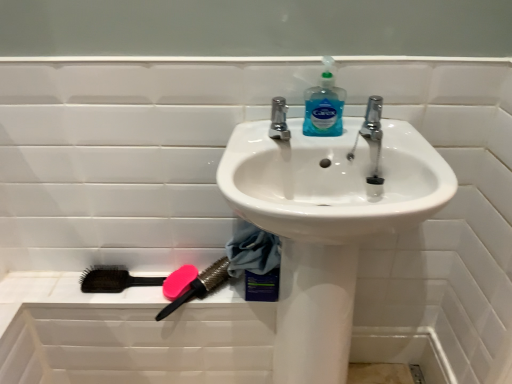
Measure the distance between black plastic brush at lower left, which is counted as the first brush, starting from the left, and camera.

black plastic brush at lower left, which is counted as the first brush, starting from the left, and camera are 1.14 meters apart from each other.

In order to click on white glossy sink at center in this screenshot , I will do `click(328, 221)`.

You are a GUI agent. You are given a task and a screenshot of the screen. Output one action in this format:
    pyautogui.click(x=<x>, y=<y>)
    Task: Click on the pink rubber brush at lower left, which is the second brush in left-to-right order
    This screenshot has width=512, height=384.
    Given the screenshot: What is the action you would take?
    pyautogui.click(x=200, y=286)

Looking at this image, could you tell me if white glossy sink at center is turned towards pink rubber brush at lower left, which appears as the 1th brush when viewed from the right?

No, white glossy sink at center is not aimed at pink rubber brush at lower left, which appears as the 1th brush when viewed from the right.

From the image's perspective, is white glossy sink at center on top of pink rubber brush at lower left, which is the second brush in left-to-right order?

No.

Based on the photo, what's the angular difference between white glossy sink at center and pink rubber brush at lower left, which appears as the 1th brush when viewed from the right,'s facing directions?

The facing directions of white glossy sink at center and pink rubber brush at lower left, which appears as the 1th brush when viewed from the right, are 1.94 degrees apart.

Which object is closer to the camera taking this photo, white glossy sink at center or pink rubber brush at lower left, which appears as the 1th brush when viewed from the right?

Positioned in front is white glossy sink at center.

From a real-world perspective, is translucent plastic soap dispenser at upper center positioned over chrome metallic faucet at upper center based on gravity?

Yes.

Consider the image. Would you consider translucent plastic soap dispenser at upper center to be distant from chrome metallic faucet at upper center?

Actually, translucent plastic soap dispenser at upper center and chrome metallic faucet at upper center are a little close together.

Locate an element on the screen. cleaning product above the chrome metallic faucet at upper center (from the image's perspective) is located at coordinates (324, 106).

Does translucent plastic soap dispenser at upper center have a lesser height compared to chrome metallic faucet at upper center?

No, translucent plastic soap dispenser at upper center is not shorter than chrome metallic faucet at upper center.

Can you tell me how much pink rubber soap at lower left and pink rubber brush at lower left, which is the second brush in left-to-right order, differ in facing direction?

They differ by 0.000563 degrees in their facing directions.

From the image's perspective, is pink rubber soap at lower left above pink rubber brush at lower left, which appears as the 1th brush when viewed from the right?

Indeed, from the image's perspective, pink rubber soap at lower left is shown above pink rubber brush at lower left, which appears as the 1th brush when viewed from the right.

Is pink rubber soap at lower left aimed at pink rubber brush at lower left, which appears as the 1th brush when viewed from the right?

Yes, pink rubber soap at lower left is aimed at pink rubber brush at lower left, which appears as the 1th brush when viewed from the right.

Considering the relative sizes of pink rubber soap at lower left and pink rubber brush at lower left, which appears as the 1th brush when viewed from the right, in the image provided, is pink rubber soap at lower left wider than pink rubber brush at lower left, which appears as the 1th brush when viewed from the right,?

No, pink rubber soap at lower left is not wider than pink rubber brush at lower left, which appears as the 1th brush when viewed from the right.

The height and width of the screenshot is (384, 512). I want to click on brush that is the 1st one below the chrome metallic faucet at upper center (from a real-world perspective), so click(x=200, y=286).

Is pink rubber brush at lower left, which is the second brush in left-to-right order, bigger or smaller than chrome metallic faucet at upper center?

Clearly, pink rubber brush at lower left, which is the second brush in left-to-right order, is larger in size than chrome metallic faucet at upper center.

Can chrome metallic faucet at upper center be found inside pink rubber brush at lower left, which is the second brush in left-to-right order?

Actually, chrome metallic faucet at upper center is outside pink rubber brush at lower left, which is the second brush in left-to-right order.

Which of these two, pink rubber brush at lower left, which is the second brush in left-to-right order, or chrome metallic faucet at upper center, is thinner?

chrome metallic faucet at upper center is thinner.

From the image's perspective, which object appears higher, pink rubber soap at lower left or chrome metallic faucet at upper center?

chrome metallic faucet at upper center, from the image's perspective.

Would you say pink rubber soap at lower left is outside chrome metallic faucet at upper center?

Yes, pink rubber soap at lower left is outside of chrome metallic faucet at upper center.

From the picture: Can you confirm if pink rubber soap at lower left is positioned to the left of chrome metallic faucet at upper center?

Correct, you'll find pink rubber soap at lower left to the left of chrome metallic faucet at upper center.

Is point (201, 292) in front of point (323, 284)?

No, it is not.

In the scene shown: Which is correct: pink rubber brush at lower left, which appears as the 1th brush when viewed from the right, is inside white glossy sink at center, or outside of it?

pink rubber brush at lower left, which appears as the 1th brush when viewed from the right, is not enclosed by white glossy sink at center.

Which of these two, pink rubber brush at lower left, which appears as the 1th brush when viewed from the right, or white glossy sink at center, is wider?

Wider between the two is white glossy sink at center.

Who is taller, black plastic brush at lower left, which is counted as the first brush, starting from the left, or pink rubber brush at lower left, which is the second brush in left-to-right order?

Standing taller between the two is pink rubber brush at lower left, which is the second brush in left-to-right order.

Is black plastic brush at lower left, arranged as the second brush when viewed from the right, bigger or smaller than pink rubber brush at lower left, which is the second brush in left-to-right order?

Considering their sizes, black plastic brush at lower left, arranged as the second brush when viewed from the right, takes up less space than pink rubber brush at lower left, which is the second brush in left-to-right order.

Visually, is black plastic brush at lower left, which is counted as the first brush, starting from the left, positioned to the left or to the right of pink rubber brush at lower left, which is the second brush in left-to-right order?

black plastic brush at lower left, which is counted as the first brush, starting from the left, is to the left of pink rubber brush at lower left, which is the second brush in left-to-right order.

Is black plastic brush at lower left, which is counted as the first brush, starting from the left, facing away from pink rubber brush at lower left, which is the second brush in left-to-right order?

black plastic brush at lower left, which is counted as the first brush, starting from the left, is not turned away from pink rubber brush at lower left, which is the second brush in left-to-right order.

The width and height of the screenshot is (512, 384). Identify the location of sink located in front of the pink rubber brush at lower left, which is the second brush in left-to-right order. (328, 221).

Find the location of a particular element. cleaning product on the right of the chrome metallic faucet at upper center is located at coordinates (324, 106).

Based on their spatial positions, is pink rubber brush at lower left, which appears as the 1th brush when viewed from the right, or pink rubber soap at lower left further from white glossy sink at center?

The object further to white glossy sink at center is pink rubber soap at lower left.

From the image, which object appears to be nearer to pink rubber brush at lower left, which is the second brush in left-to-right order, pink rubber soap at lower left or translucent plastic soap dispenser at upper center?

The object closer to pink rubber brush at lower left, which is the second brush in left-to-right order, is pink rubber soap at lower left.

Based on the photo, which object lies nearer to the anchor point black plastic brush at lower left, arranged as the second brush when viewed from the right, pink rubber brush at lower left, which is the second brush in left-to-right order, or chrome metallic faucet at upper center?

pink rubber brush at lower left, which is the second brush in left-to-right order, lies closer to black plastic brush at lower left, arranged as the second brush when viewed from the right, than the other object.

Which object lies nearer to the anchor point pink rubber soap at lower left, pink rubber brush at lower left, which is the second brush in left-to-right order, or white glossy sink at center?

The object closer to pink rubber soap at lower left is pink rubber brush at lower left, which is the second brush in left-to-right order.

In the scene shown: Based on their spatial positions, is black plastic brush at lower left, arranged as the second brush when viewed from the right, or translucent plastic soap dispenser at upper center closer to pink rubber soap at lower left?

black plastic brush at lower left, arranged as the second brush when viewed from the right.

Considering their positions, is pink rubber brush at lower left, which appears as the 1th brush when viewed from the right, positioned further to white glossy sink at center than chrome metallic faucet at upper center?

pink rubber brush at lower left, which appears as the 1th brush when viewed from the right.

Based on their spatial positions, is white glossy sink at center or black plastic brush at lower left, which is counted as the first brush, starting from the left, closer to pink rubber soap at lower left?

black plastic brush at lower left, which is counted as the first brush, starting from the left, is positioned closer to the anchor pink rubber soap at lower left.

From the image, which object appears to be farther from translucent plastic soap dispenser at upper center, pink rubber brush at lower left, which is the second brush in left-to-right order, or pink rubber soap at lower left?

pink rubber soap at lower left.

At what (x,y) coordinates should I click in order to perform the action: click on soap located between black plastic brush at lower left, which is counted as the first brush, starting from the left, and pink rubber brush at lower left, which appears as the 1th brush when viewed from the right, in the left-right direction. Please return your answer as a coordinate pair (x, y). This screenshot has width=512, height=384. Looking at the image, I should click on (179, 281).

I want to click on brush between chrome metallic faucet at upper center and pink rubber soap at lower left in the vertical direction, so click(x=113, y=279).

Where is `soap between black plastic brush at lower left, which is counted as the first brush, starting from the left, and white glossy sink at center`? The width and height of the screenshot is (512, 384). soap between black plastic brush at lower left, which is counted as the first brush, starting from the left, and white glossy sink at center is located at coordinates tap(179, 281).

Image resolution: width=512 pixels, height=384 pixels. In order to click on cleaning product situated between black plastic brush at lower left, which is counted as the first brush, starting from the left, and white glossy sink at center from left to right in this screenshot , I will do `click(324, 106)`.